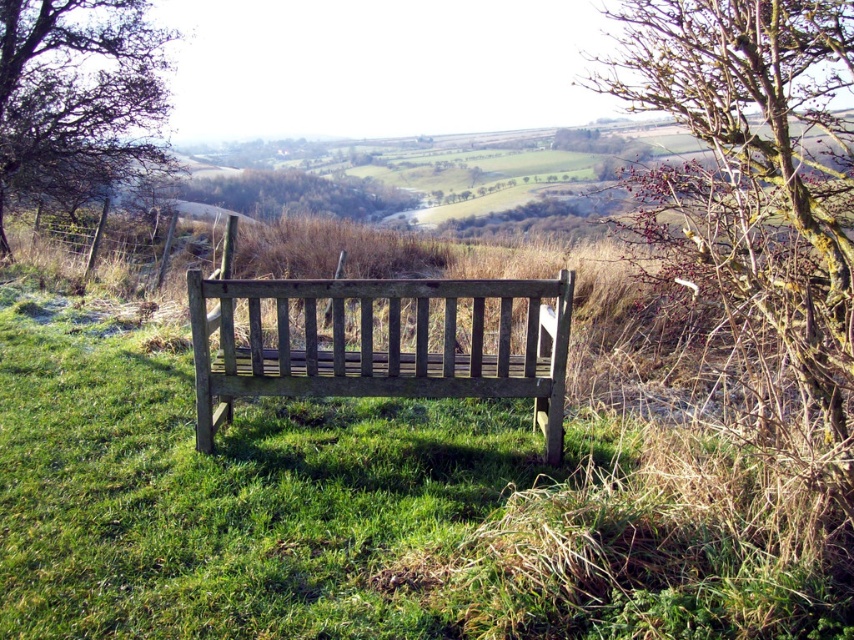
You are a painter setting up your easel to capture the view of the wooden bench at center and the brown textured tree at upper left. Which object is taller when viewed from your position?

The brown textured tree at upper left is taller than the wooden bench at center.

You are standing in front of the wooden bench at center in the rural landscape scene. If you want to take a photo of the bench from where you are standing, will the entire bench fit in the frame of a camera with a 50mm lens set to f2.8 aperture? Please explain your reasoning based on the bench distance from the camera.

The wooden bench at center is 12.60 feet away from the camera. With a 50mm lens at f2.8 aperture, the depth of field at 12.60 feet would likely keep the entire bench in focus and within the frame, assuming standard framing techniques. However, the exact fit depends on the camera sensor size and how the bench is positioned within the shot.